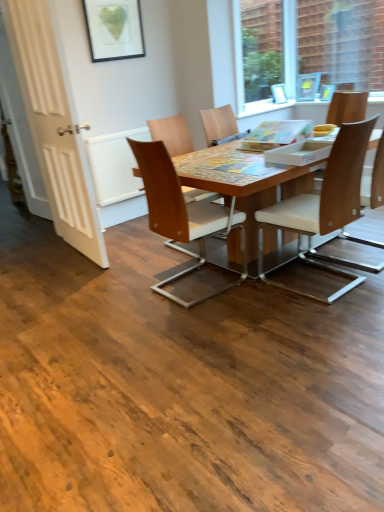
Locate an element on the screen. free location in front of wooden chair at center, the 5th chair positioned from the right is located at coordinates (210, 327).